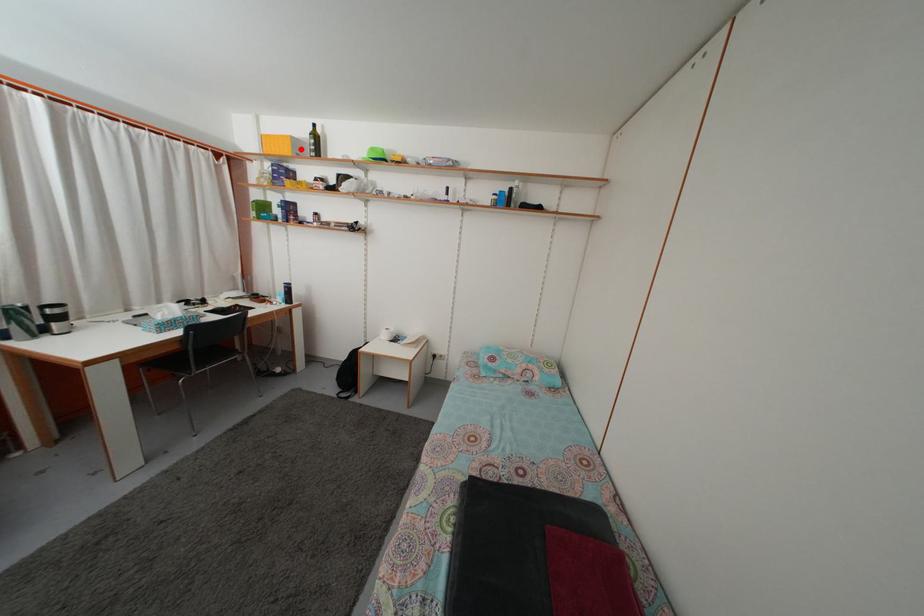
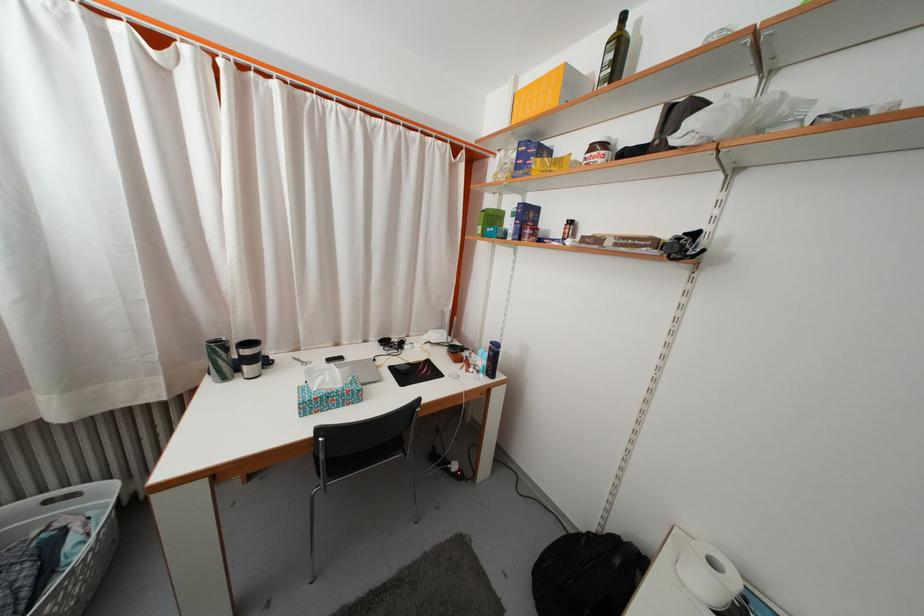
Find the pixel in the second image that matches the highlighted location in the first image.

(575, 84)